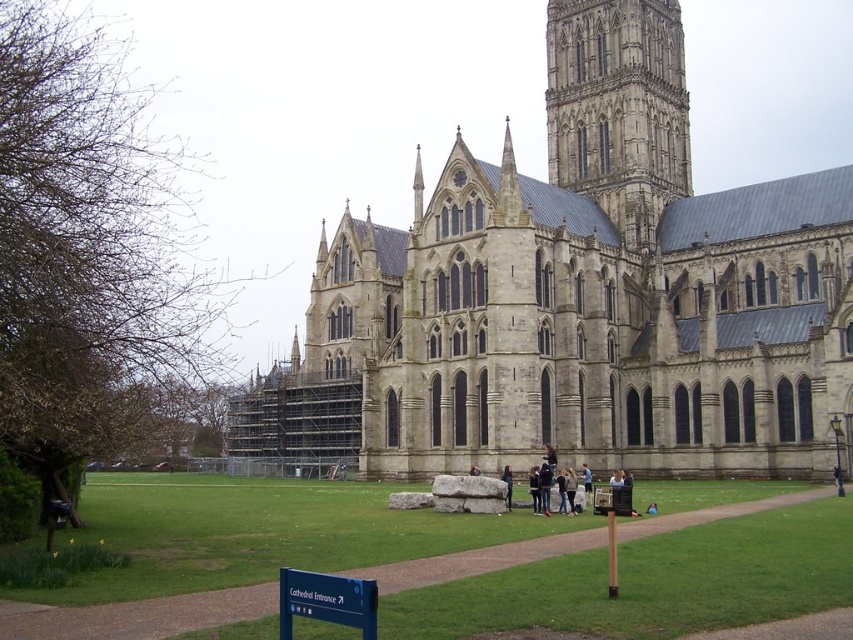
Is stone gothic tower at center to the left of dark blue fabric jacket at center from the viewer's perspective?

In fact, stone gothic tower at center is to the right of dark blue fabric jacket at center.

Between stone gothic tower at center and dark blue fabric jacket at center, which one has less height?

With less height is dark blue fabric jacket at center.

Between point (601, 70) and point (503, 472), which one is positioned in front?

Point (503, 472) is more forward.

Where is `stone gothic tower at center`? The width and height of the screenshot is (853, 640). stone gothic tower at center is located at coordinates (618, 108).

Measure the distance from stone gothic tower at center to green grass at center.

stone gothic tower at center is 47.97 meters from green grass at center.

Does point (556, 106) come in front of point (125, 636)?

No, (556, 106) is further to viewer.

The image size is (853, 640). Find the location of `stone gothic tower at center`. stone gothic tower at center is located at coordinates (618, 108).

Can you confirm if stone church at center is bigger than green grass at center?

Yes, stone church at center is bigger than green grass at center.

Can you confirm if stone church at center is positioned below green grass at center?

No, stone church at center is not below green grass at center.

Who is more forward, (x=792, y=358) or (x=96, y=630)?

Point (x=96, y=630) is more forward.

What are the coordinates of `stone church at center` in the screenshot? It's located at (579, 296).